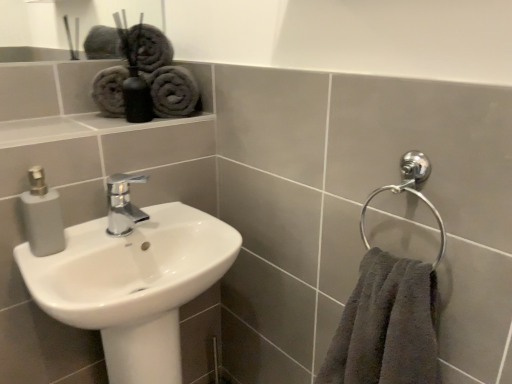
Question: Can you confirm if gray cotton towels at upper left is smaller than white glossy sink at lower left?

Choices:
 (A) no
 (B) yes

Answer: (B)

Question: From the image's perspective, would you say gray cotton towels at upper left is shown under white glossy sink at lower left?

Choices:
 (A) yes
 (B) no

Answer: (B)

Question: Is gray cotton towels at upper left outside of white glossy sink at lower left?

Choices:
 (A) no
 (B) yes

Answer: (B)

Question: From the image's perspective, is gray cotton towels at upper left on white glossy sink at lower left?

Choices:
 (A) no
 (B) yes

Answer: (B)

Question: Is gray cotton towels at upper left far away from white glossy sink at lower left?

Choices:
 (A) yes
 (B) no

Answer: (B)

Question: In terms of width, does polished chrome faucet at center look wider or thinner when compared to white glossy sink at lower left?

Choices:
 (A) thin
 (B) wide

Answer: (A)

Question: Is polished chrome faucet at center bigger or smaller than white glossy sink at lower left?

Choices:
 (A) small
 (B) big

Answer: (A)

Question: Is polished chrome faucet at center in front of or behind white glossy sink at lower left in the image?

Choices:
 (A) front
 (B) behind

Answer: (B)

Question: Considering the relative positions of polished chrome faucet at center and white glossy sink at lower left in the image provided, is polished chrome faucet at center to the left or to the right of white glossy sink at lower left?

Choices:
 (A) right
 (B) left

Answer: (B)

Question: From the image's perspective, relative to gray cotton towels at upper left, is polished chrome faucet at center above or below?

Choices:
 (A) below
 (B) above

Answer: (A)

Question: In terms of height, does polished chrome faucet at center look taller or shorter compared to gray cotton towels at upper left?

Choices:
 (A) tall
 (B) short

Answer: (B)

Question: Is polished chrome faucet at center bigger or smaller than gray cotton towels at upper left?

Choices:
 (A) big
 (B) small

Answer: (B)

Question: Is point pyautogui.click(x=114, y=190) closer or farther from the camera than point pyautogui.click(x=192, y=109)?

Choices:
 (A) farther
 (B) closer

Answer: (B)

Question: Considering the positions of gray cotton towels at upper left and dark gray plush towel at right in the image, is gray cotton towels at upper left wider or thinner than dark gray plush towel at right?

Choices:
 (A) thin
 (B) wide

Answer: (A)

Question: Is gray cotton towels at upper left inside or outside of dark gray plush towel at right?

Choices:
 (A) outside
 (B) inside

Answer: (A)